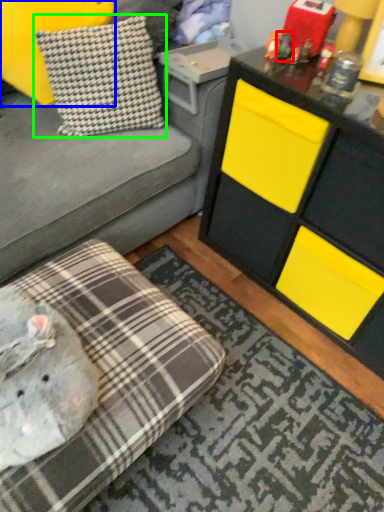
Question: Based on their relative distances, which object is farther from toy (highlighted by a red box)? Choose from pillow (highlighted by a blue box) and pillow (highlighted by a green box).

Choices:
 (A) pillow
 (B) pillow

Answer: (A)